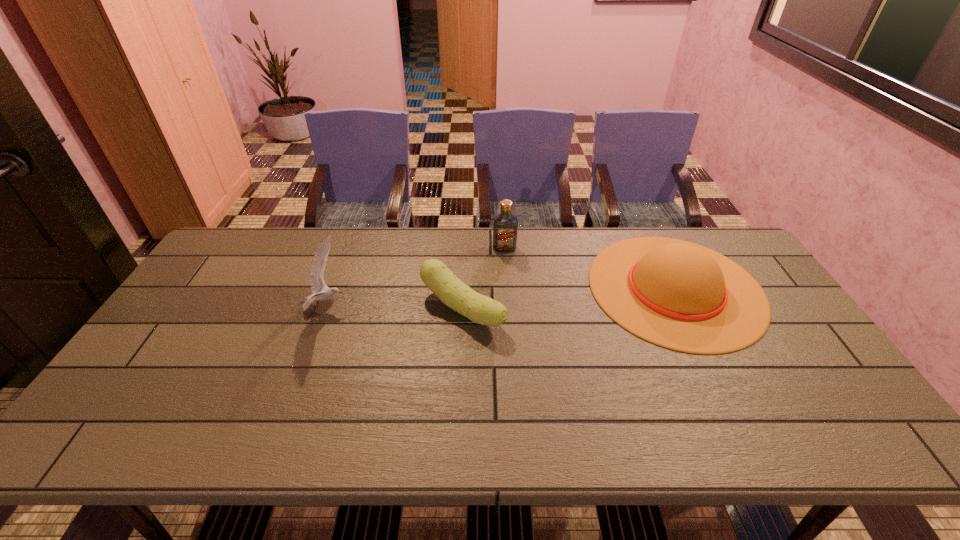
Find the location of a particular element. This screenshot has height=540, width=960. vacant area in the image that satisfies the following two spatial constraints: 1. at the tip of the beak of the leftmost object; 2. on the back side of the shortest object is located at coordinates (324, 309).

Find the location of a particular element. The width and height of the screenshot is (960, 540). vacant position in the image that satisfies the following two spatial constraints: 1. on the front-facing side of the vodka; 2. at the tip of the beak of the gull is located at coordinates (509, 308).

The image size is (960, 540). In order to click on free space in the image that satisfies the following two spatial constraints: 1. on the back side of the cucumber; 2. at the tip of the beak of the leftmost object in this screenshot , I will do point(463,308).

Where is `free space that satisfies the following two spatial constraints: 1. on the front-facing side of the vodka; 2. on the right side of the second shortest object`? free space that satisfies the following two spatial constraints: 1. on the front-facing side of the vodka; 2. on the right side of the second shortest object is located at coordinates (507, 288).

Where is `vacant space that satisfies the following two spatial constraints: 1. on the back side of the cucumber; 2. on the right side of the sombrero`? Image resolution: width=960 pixels, height=540 pixels. vacant space that satisfies the following two spatial constraints: 1. on the back side of the cucumber; 2. on the right side of the sombrero is located at coordinates (464, 288).